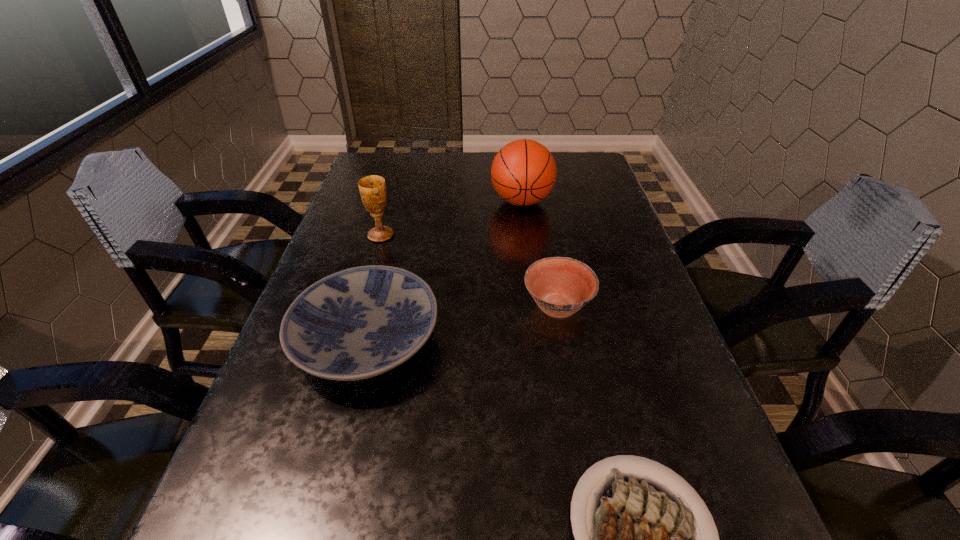
Locate an element on the screen. The width and height of the screenshot is (960, 540). basketball is located at coordinates coord(523,172).

Locate an element on the screen. The image size is (960, 540). the second tallest object is located at coordinates (372, 188).

Locate an element on the screen. chalice is located at coordinates (372, 188).

Locate an element on the screen. bowl is located at coordinates (560, 286).

This screenshot has width=960, height=540. I want to click on the farther plate, so click(x=361, y=322).

Where is `the left plate`? This screenshot has width=960, height=540. the left plate is located at coordinates click(361, 322).

I want to click on free space located on the back of the basketball, so click(516, 156).

This screenshot has width=960, height=540. Identify the location of blank space located on the back of the chalice. (392, 196).

At what (x,y) coordinates should I click in order to perform the action: click on blank area located 0.080m on the back of the bowl. Please return your answer as a coordinate pair (x, y). The width and height of the screenshot is (960, 540). Looking at the image, I should click on (548, 261).

The image size is (960, 540). I want to click on vacant region located 0.390m on the back of the taller plate, so click(402, 198).